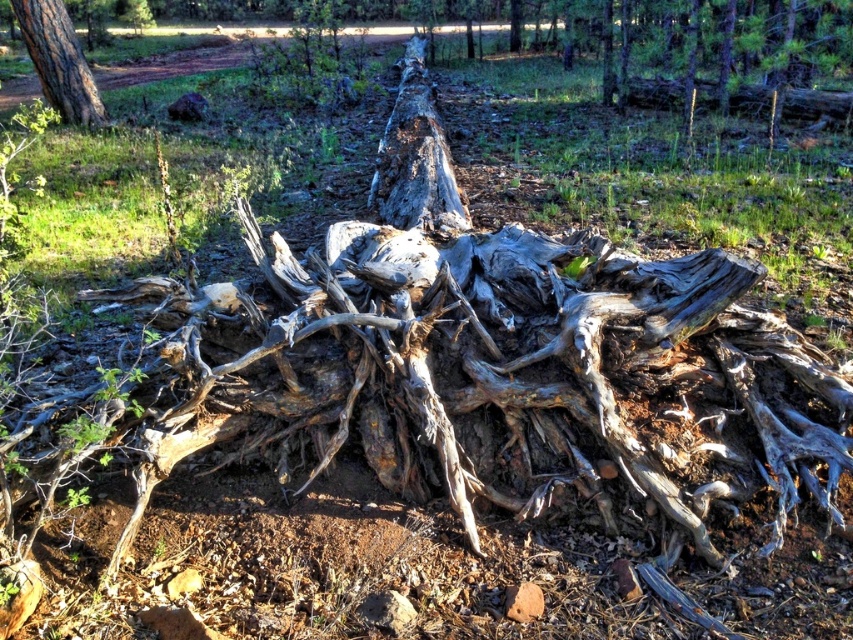
You are a hiker trying to navigate through the forest. You see the gray rough bark tree trunk at center and the gray rough bark tree trunk at upper left. Which one is nearer to you?

The gray rough bark tree trunk at center is closer to the viewer than the gray rough bark tree trunk at upper left, so the gray rough trunk at center is nearer to you.

You are a hiker trying to determine which tree trunk to sit on for a rest. The gray rough bark tree trunk at center and the gray rough bark tree trunk at upper left are both available. Based on their sizes, which one would be more stable to sit on?

The gray rough bark tree trunk at center is larger in size than the gray rough bark tree trunk at upper left, so it would be more stable to sit on.

You are standing at the origin point of the forest scene. Where is the gray rough bark tree trunk at center located in terms of coordinates?

The gray rough bark tree trunk at center is located at coordinates point (415, 156).